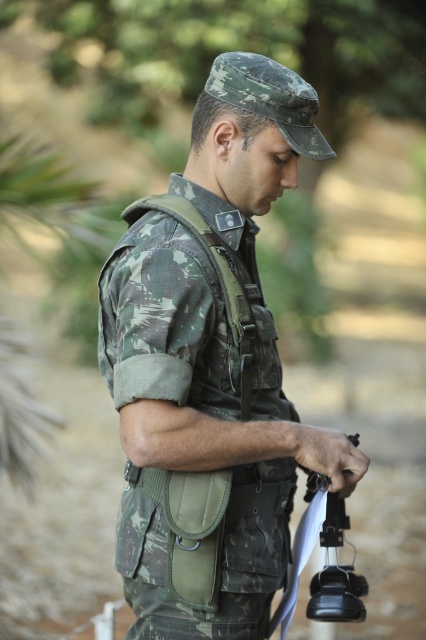
Consider the image. Can you confirm if camouflage fabric uniform at center is smaller than black plastic gun at center?

Actually, camouflage fabric uniform at center might be larger than black plastic gun at center.

Who is taller, camouflage fabric uniform at center or black plastic gun at center?

With more height is camouflage fabric uniform at center.

I want to click on camouflage fabric uniform at center, so click(x=210, y=369).

At what (x,y) coordinates should I click in order to perform the action: click on camouflage fabric uniform at center. Please return your answer as a coordinate pair (x, y). The height and width of the screenshot is (640, 426). Looking at the image, I should click on (210, 369).